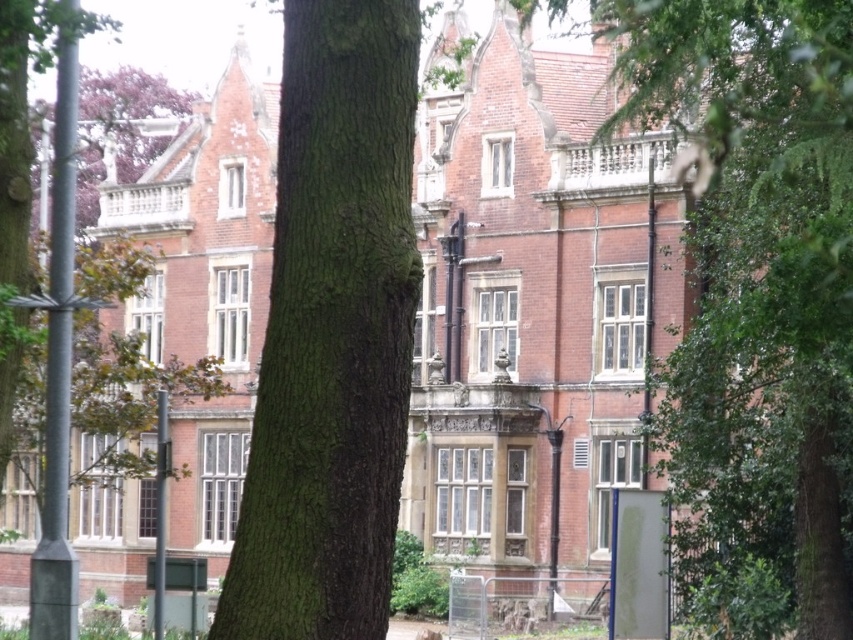
You are standing in front of the historic brick building and notice the green leafy tree at center. Based on its position, can you determine if the tree is closer to the building or further away from it?

The green leafy tree at center is located at point (758,260), which places it closer to the building compared to the foreground elements, but since the tree trunk is in the foreground on the left, the tree is actually part of the foreground and closer to the viewer than the building. However, the coordinates might indicate its position relative to the image frame rather than depth. Without explicit depth information, we can infer from the scene description that the tree trunk is in the foreground, so the

You are an architect examining the historic brick building and notice two trees in the foreground. Which tree is smaller in size between the green leafy tree at center and the green rough bark tree at center?

The green leafy tree at center is smaller in size compared to the green rough bark tree at center.